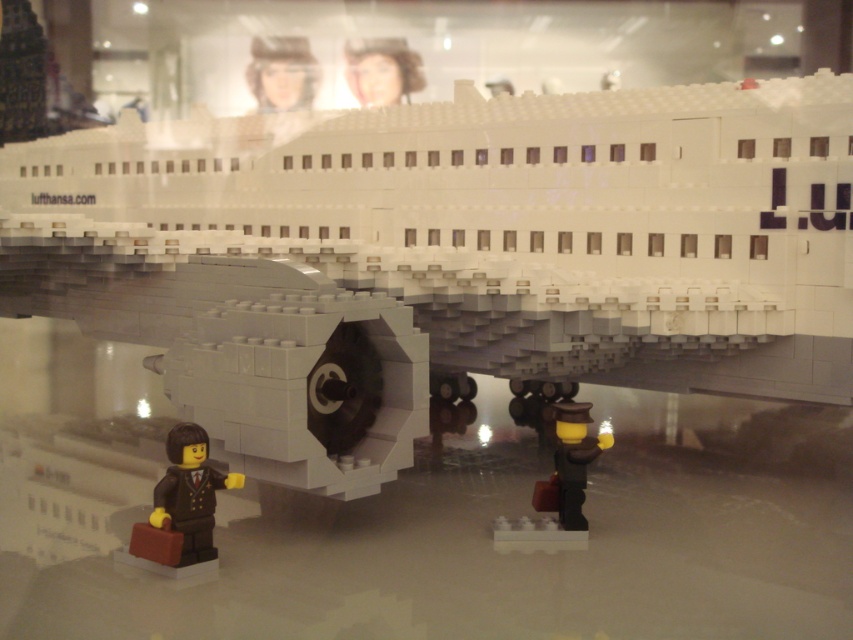
Does point (154, 488) come closer to viewer compared to point (280, 67)?

That is True.

What do you see at coordinates (189, 493) in the screenshot? Image resolution: width=853 pixels, height=640 pixels. I see `brown matte briefcase at lower left` at bounding box center [189, 493].

The height and width of the screenshot is (640, 853). In order to click on brown matte briefcase at lower left in this screenshot , I will do `click(189, 493)`.

From the picture: Is brown matte briefcase at lower left smaller than matte white airplane at center?

Correct, brown matte briefcase at lower left occupies less space than matte white airplane at center.

Is point (155, 508) closer to viewer compared to point (387, 72)?

Yes, it is in front of point (387, 72).

Locate an element on the screen. brown matte briefcase at lower left is located at coordinates (189, 493).

Identify the location of matte plastic head at upper center. (281, 72).

Does matte plastic head at upper center have a greater width compared to matte white airplane at center?

No, matte plastic head at upper center is not wider than matte white airplane at center.

Is point (250, 81) positioned before point (351, 44)?

No, (250, 81) is further to viewer.

At what (x,y) coordinates should I click in order to perform the action: click on matte plastic head at upper center. Please return your answer as a coordinate pair (x, y). Looking at the image, I should click on (281, 72).